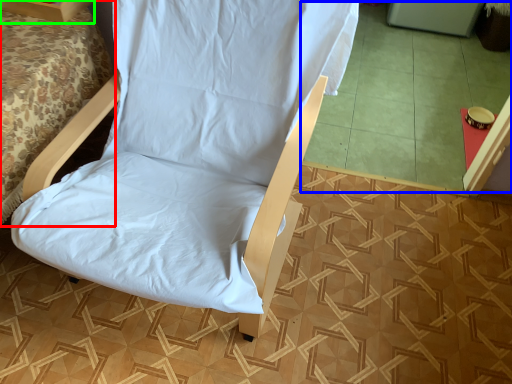
Question: Which is farther away from bed (highlighted by a red box)? tile (highlighted by a blue box) or furniture (highlighted by a green box)?

Choices:
 (A) tile
 (B) furniture

Answer: (A)